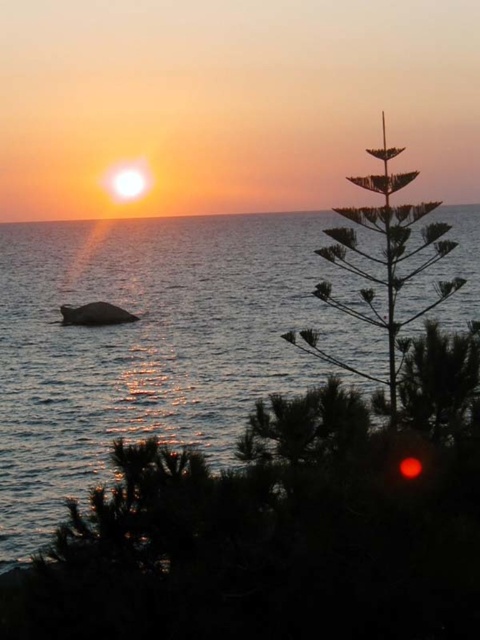
Based on the photo, you are an artist trying to paint the sunset scene. You have to decide which object to paint first based on their sizes. According to the scene, which object should you start with, the silvery metallic tree at right or the smooth ocean surface at center?

The silvery metallic tree at right is smaller than the smooth ocean surface at center. Therefore, you should start with the silvery metallic tree at right since smaller details are often painted first to avoid smudging larger areas.